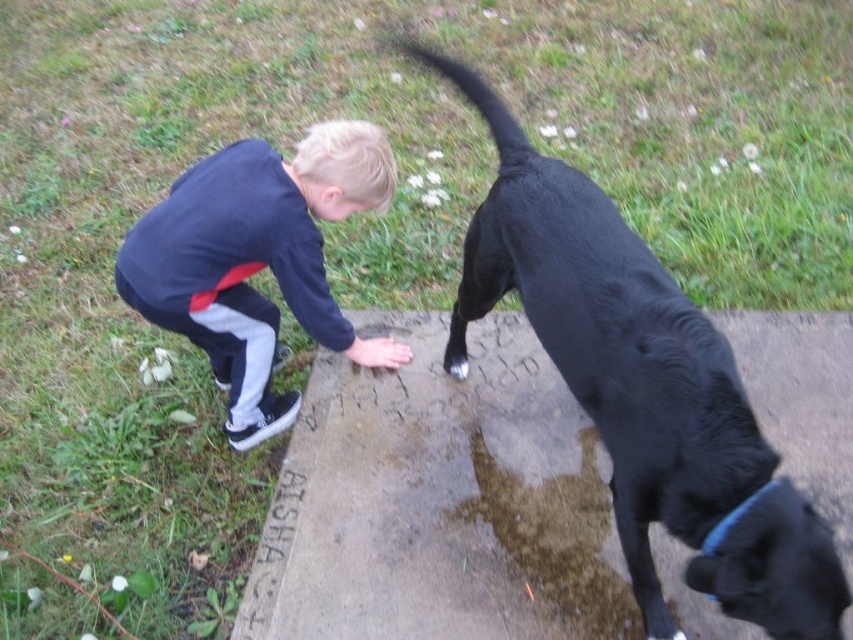
You are a photographer trying to capture the black dog at lower right in the image. The camera you are using has a focus point at coordinate point (642, 388). Is this focus point likely to successfully capture the black dog at lower right?

The point (642, 388) indicates the black smooth dog at lower right, so yes, the focus point at coordinate point (642, 388) will successfully capture the black dog at lower right.

You are a photographer trying to capture a photo of the black smooth dog at lower right and the dark blue sweatshirt at center. Since you want both subjects to appear equally prominent in the photo, which one should you zoom in on more?

The black smooth dog at lower right is larger in size than the dark blue sweatshirt at center, so you should zoom in more on the dark blue sweatshirt at center to balance their prominence in the photo.